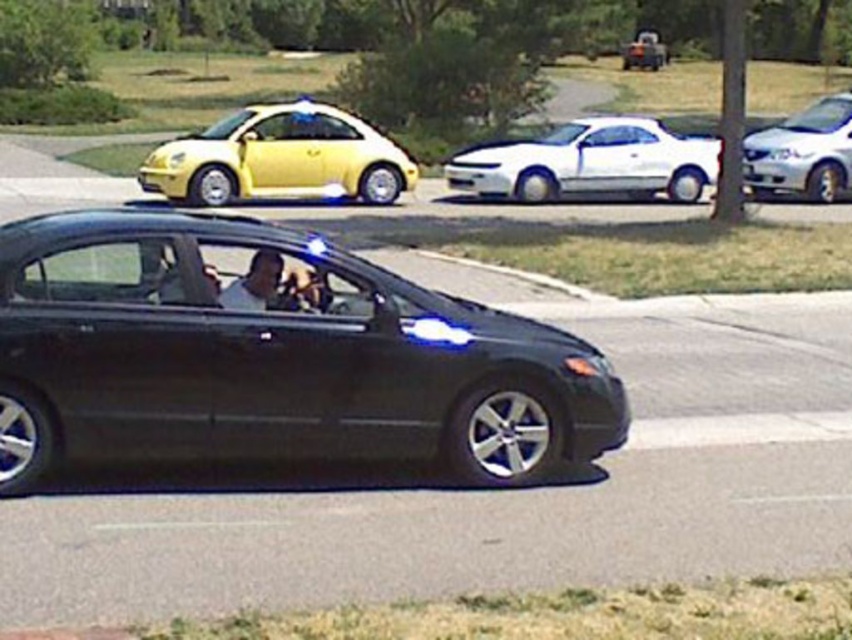
Question: Among these points, which one is farthest from the camera?

Choices:
 (A) (643, 51)
 (B) (712, 166)
 (C) (327, 154)

Answer: (A)

Question: Does shiny yellow car at center have a greater width compared to white glossy sedan at center?

Choices:
 (A) yes
 (B) no

Answer: (B)

Question: Which point is farther from the camera taking this photo?

Choices:
 (A) (286, 106)
 (B) (268, 285)
 (C) (705, 157)

Answer: (C)

Question: Is glossy black sedan at center wider than white glossy sedan at center?

Choices:
 (A) yes
 (B) no

Answer: (B)

Question: Which of these objects is positioned closest to the white glossy sedan at center?

Choices:
 (A) white matte shirt at center
 (B) glossy black sedan at center
 (C) metallic silver truck at upper center
 (D) shiny yellow car at center

Answer: (D)

Question: Does white glossy sedan at center have a lesser width compared to white glossy sedan at upper right?

Choices:
 (A) yes
 (B) no

Answer: (A)